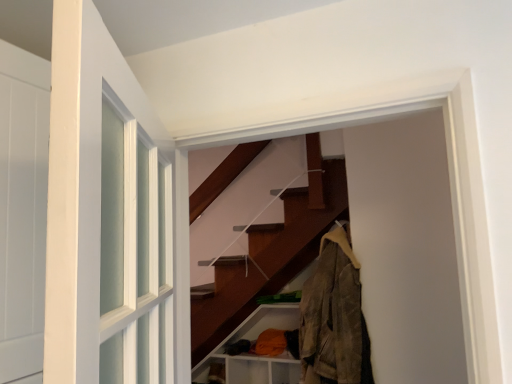
Identify the location of orange fabric at lower right. This screenshot has width=512, height=384. (255, 355).

Image resolution: width=512 pixels, height=384 pixels. Describe the element at coordinates (210, 372) in the screenshot. I see `brown matte shelf at lower center` at that location.

What is the approximate width of brown matte shelf at lower center?

brown matte shelf at lower center is 10.17 inches wide.

You are a GUI agent. You are given a task and a screenshot of the screen. Output one action in this format:
    pyautogui.click(x=<x>, y=<y>)
    Task: Click on the orange fabric at lower right
    The width and height of the screenshot is (512, 384).
    Given the screenshot: What is the action you would take?
    pyautogui.click(x=255, y=355)

Is brown matte shelf at lower center turned away from orange fabric at lower right?

Correct, brown matte shelf at lower center is looking away from orange fabric at lower right.

Which object is wider, brown matte shelf at lower center or orange fabric at lower right?

orange fabric at lower right is wider.

The width and height of the screenshot is (512, 384). I want to click on shelf that appears behind the orange fabric at lower right, so click(210, 372).

Is camouflage fabric jacket at right in contact with brown matte shelf at lower center?

No, camouflage fabric jacket at right is not with brown matte shelf at lower center.

Measure the distance from camouflage fabric jacket at right to brown matte shelf at lower center.

camouflage fabric jacket at right and brown matte shelf at lower center are 3.73 feet apart.

How different are the orientations of camouflage fabric jacket at right and brown matte shelf at lower center in degrees?

camouflage fabric jacket at right and brown matte shelf at lower center are facing 0.00316 degrees away from each other.

Based on the photo, is camouflage fabric jacket at right oriented towards brown matte shelf at lower center?

No, camouflage fabric jacket at right does not turn towards brown matte shelf at lower center.

How much distance is there between camouflage fabric jacket at right and orange fabric at lower right?

The distance of camouflage fabric jacket at right from orange fabric at lower right is 32.55 inches.

Is camouflage fabric jacket at right taller or shorter than orange fabric at lower right?

In the image, camouflage fabric jacket at right appears to be taller than orange fabric at lower right.

Can you confirm if camouflage fabric jacket at right is thinner than orange fabric at lower right?

Yes, camouflage fabric jacket at right is thinner than orange fabric at lower right.

Relative to orange fabric at lower right, is camouflage fabric jacket at right in front or behind?

Visually, camouflage fabric jacket at right is located in front of orange fabric at lower right.

From the image's perspective, is orange fabric at lower right located above or below brown matte shelf at lower center?

Based on their image positions, orange fabric at lower right is located above brown matte shelf at lower center.

What's the angular difference between orange fabric at lower right and brown matte shelf at lower center's facing directions?

There is a 0.00308-degree angle between the facing directions of orange fabric at lower right and brown matte shelf at lower center.

Looking at this image, which point is more forward, (243, 330) or (224, 362)?

Point (243, 330)

The image size is (512, 384). In order to click on shelf on the left of the orange fabric at lower right in this screenshot , I will do `click(210, 372)`.

This screenshot has width=512, height=384. I want to click on shelf below the camouflage fabric jacket at right (from the image's perspective), so click(210, 372).

Considering the points (209, 374) and (351, 368), which point is in front, point (209, 374) or point (351, 368)?

The point (351, 368) is closer to the camera.

From the image's perspective, is brown matte shelf at lower center above or below camouflage fabric jacket at right?

Clearly, from the image's perspective, brown matte shelf at lower center is below camouflage fabric jacket at right.

Is orange fabric at lower right beside camouflage fabric jacket at right?

No, orange fabric at lower right is not making contact with camouflage fabric jacket at right.

From the image's perspective, is orange fabric at lower right located above or below camouflage fabric jacket at right?

Based on their image positions, orange fabric at lower right is located beneath camouflage fabric jacket at right.

Between orange fabric at lower right and camouflage fabric jacket at right, which one appears on the right side from the viewer's perspective?

From the viewer's perspective, camouflage fabric jacket at right appears more on the right side.

This screenshot has width=512, height=384. In order to click on shelf located behind the orange fabric at lower right in this screenshot , I will do pyautogui.click(x=210, y=372).

The image size is (512, 384). What are the coordinates of `shelf beneath the camouflage fabric jacket at right (from a real-world perspective)` in the screenshot? It's located at (210, 372).

When comparing their distances from camouflage fabric jacket at right, does brown matte shelf at lower center or orange fabric at lower right seem further?

Based on the image, brown matte shelf at lower center appears to be further to camouflage fabric jacket at right.

Looking at the image, which one is located further to brown matte shelf at lower center, camouflage fabric jacket at right or orange fabric at lower right?

camouflage fabric jacket at right is positioned further to the anchor brown matte shelf at lower center.

Based on their spatial positions, is orange fabric at lower right or brown matte shelf at lower center closer to camouflage fabric jacket at right?

orange fabric at lower right is positioned closer to the anchor camouflage fabric jacket at right.

Looking at the image, which one is located further to brown matte shelf at lower center, orange fabric at lower right or camouflage fabric jacket at right?

camouflage fabric jacket at right lies further to brown matte shelf at lower center than the other object.

Looking at the image, which one is located further to orange fabric at lower right, camouflage fabric jacket at right or brown matte shelf at lower center?

Based on the image, camouflage fabric jacket at right appears to be further to orange fabric at lower right.

Based on their spatial positions, is brown matte shelf at lower center or camouflage fabric jacket at right further from orange fabric at lower right?

camouflage fabric jacket at right is further to orange fabric at lower right.

I want to click on cabinet between camouflage fabric jacket at right and brown matte shelf at lower center from front to back, so click(255, 355).